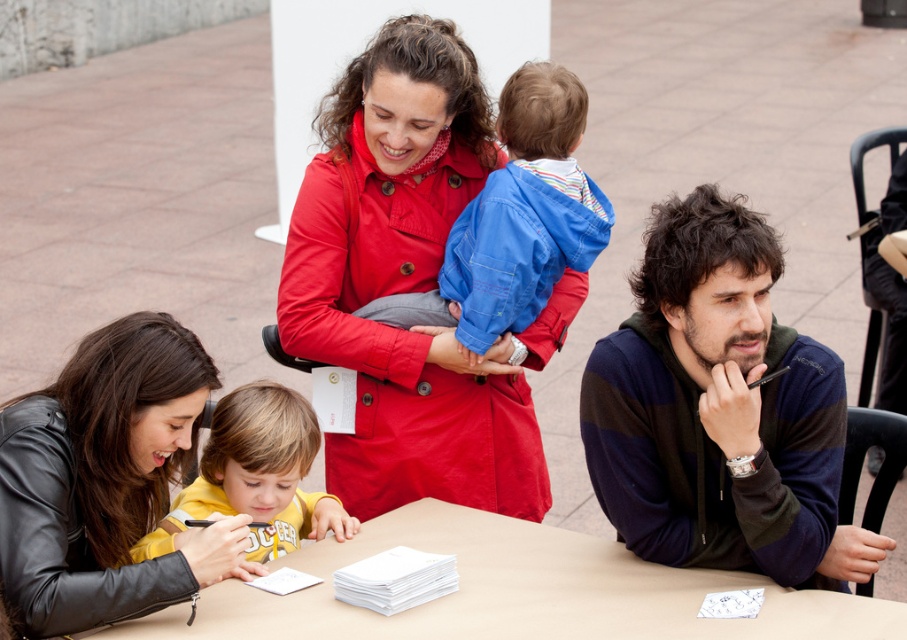
Is matte red coat at center taller than black leather jacket at lower left?

Yes, matte red coat at center is taller than black leather jacket at lower left.

Which is below, matte red coat at center or black leather jacket at lower left?

black leather jacket at lower left

Find the location of a particular element. The height and width of the screenshot is (640, 907). matte red coat at center is located at coordinates (405, 282).

The image size is (907, 640). In order to click on matte red coat at center in this screenshot , I will do `click(405, 282)`.

This screenshot has height=640, width=907. Describe the element at coordinates (405, 282) in the screenshot. I see `matte red coat at center` at that location.

Does point (502, 461) lie in front of point (645, 356)?

No.

The width and height of the screenshot is (907, 640). I want to click on matte red coat at center, so click(x=405, y=282).

Can you confirm if smooth beige table at lower center is thinner than blue cotton jacket at center?

No.

Identify the location of smooth beige table at lower center. (514, 592).

Identify the location of smooth beige table at lower center. This screenshot has height=640, width=907. (514, 592).